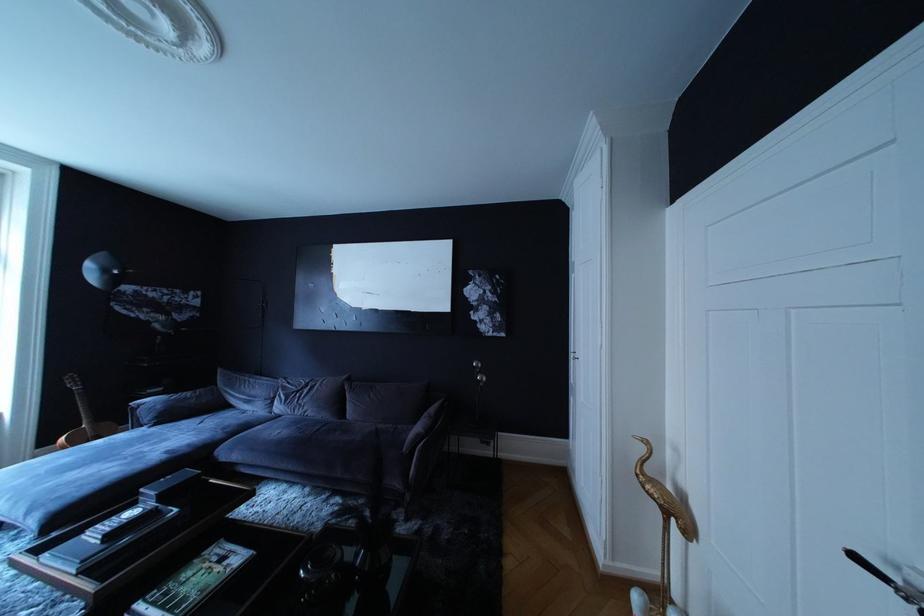
This screenshot has height=616, width=924. I want to click on sofa armrest, so click(x=426, y=456).